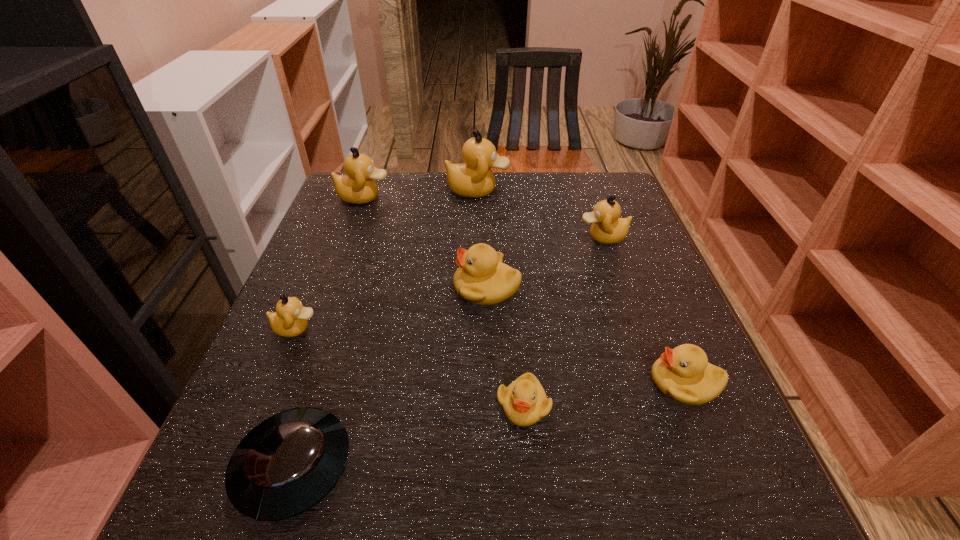
Where is `the second tan duckling from right to left`? the second tan duckling from right to left is located at coordinates (474, 178).

This screenshot has height=540, width=960. What are the coordinates of `the tallest duckling` in the screenshot? It's located at (474, 178).

Image resolution: width=960 pixels, height=540 pixels. Find the location of `the third smallest tan duckling`. the third smallest tan duckling is located at coordinates (357, 187).

You are a GUI agent. You are given a task and a screenshot of the screen. Output one action in this format:
    pyautogui.click(x=<x>, y=<y>)
    Task: Click on the seventh shortest object
    
    Given the screenshot: What is the action you would take?
    pyautogui.click(x=357, y=187)

Image resolution: width=960 pixels, height=540 pixels. What are the coordinates of `the rightmost tan duckling` in the screenshot? It's located at (607, 228).

I want to click on the second nearest tan duckling, so click(x=607, y=228).

Image resolution: width=960 pixels, height=540 pixels. Identify the location of the biggest yellow duckling. (482, 279).

Locate an element on the screen. This screenshot has height=540, width=960. the fifth nearest object is located at coordinates (482, 279).

Locate an element on the screen. the fifth farthest duckling is located at coordinates (291, 318).

The height and width of the screenshot is (540, 960). I want to click on the nearest tan duckling, so click(291, 318).